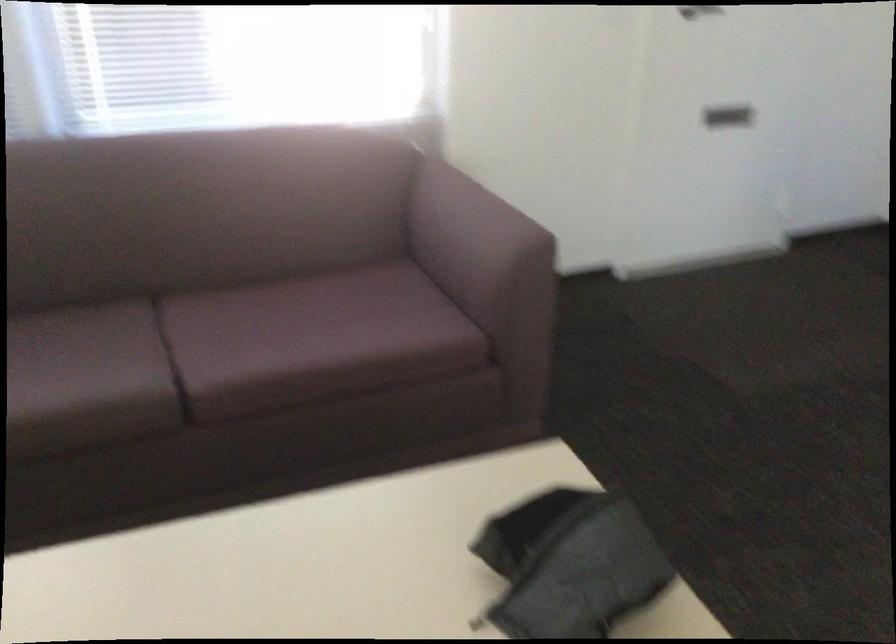
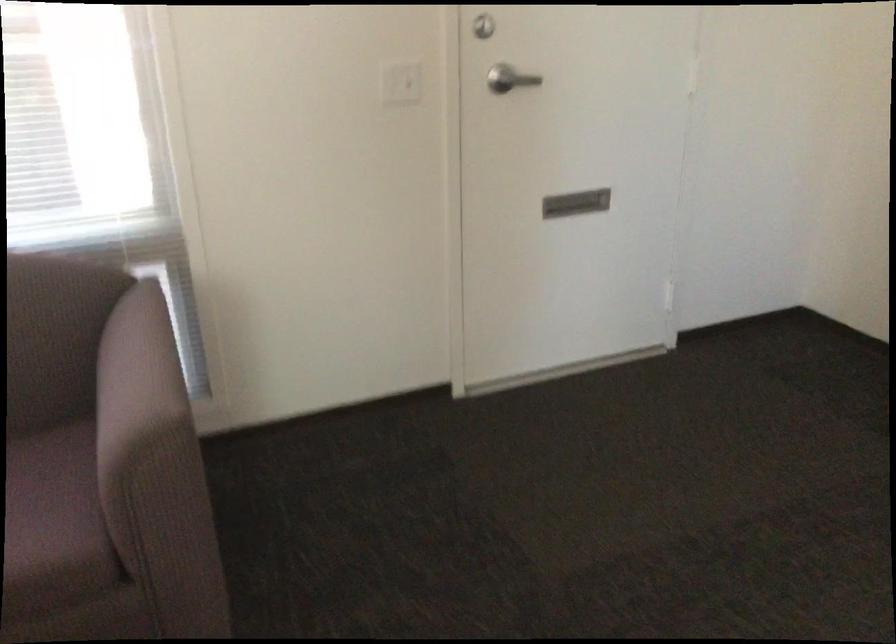
Find the pixel in the second image that matches (739,114) in the first image.

(575, 203)